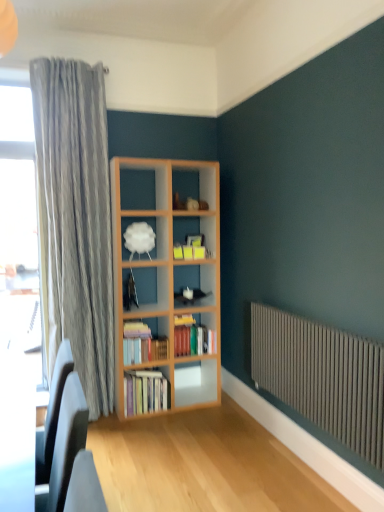
Question: Is white matte cloud at center in front of or behind hardcover books at center, the 1th book from the top, in the image?

Choices:
 (A) behind
 (B) front

Answer: (B)

Question: Looking at their shapes, would you say white matte cloud at center is wider or thinner than hardcover books at center, the 1th book from the top?

Choices:
 (A) wide
 (B) thin

Answer: (B)

Question: Estimate the real-world distances between objects in this image. Which object is farther from the hardcover books at center, placed as the second book when sorted from bottom to top?

Choices:
 (A) matte black swivel chair at lower left
 (B) hardcover books at center, the 3th book viewed from the top
 (C) gray metallic radiator at lower right
 (D) white matte cloud at center
 (E) hardcover books at center, the third book positioned from the bottom

Answer: (A)

Question: Estimate the real-world distances between objects in this image. Which object is farther from the white matte cloud at center?

Choices:
 (A) hardcover books at center, the 1th book from the top
 (B) hardcover books at center, placed as the second book when sorted from bottom to top
 (C) hardcover books at center, which is counted as the first book, starting from the bottom
 (D) matte black swivel chair at lower left
 (E) gray metallic radiator at lower right

Answer: (D)